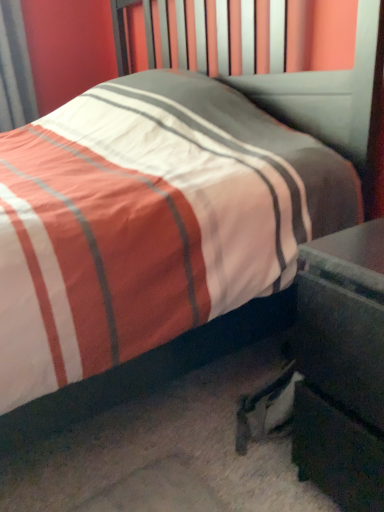
Image resolution: width=384 pixels, height=512 pixels. What do you see at coordinates (342, 366) in the screenshot?
I see `black glossy nightstand at lower right` at bounding box center [342, 366].

Measure the distance between black glossy nightstand at lower right and camera.

A distance of 22.69 inches exists between black glossy nightstand at lower right and camera.

This screenshot has height=512, width=384. Identify the location of black glossy nightstand at lower right. (342, 366).

Where is `black glossy nightstand at lower right`? The image size is (384, 512). black glossy nightstand at lower right is located at coordinates (342, 366).